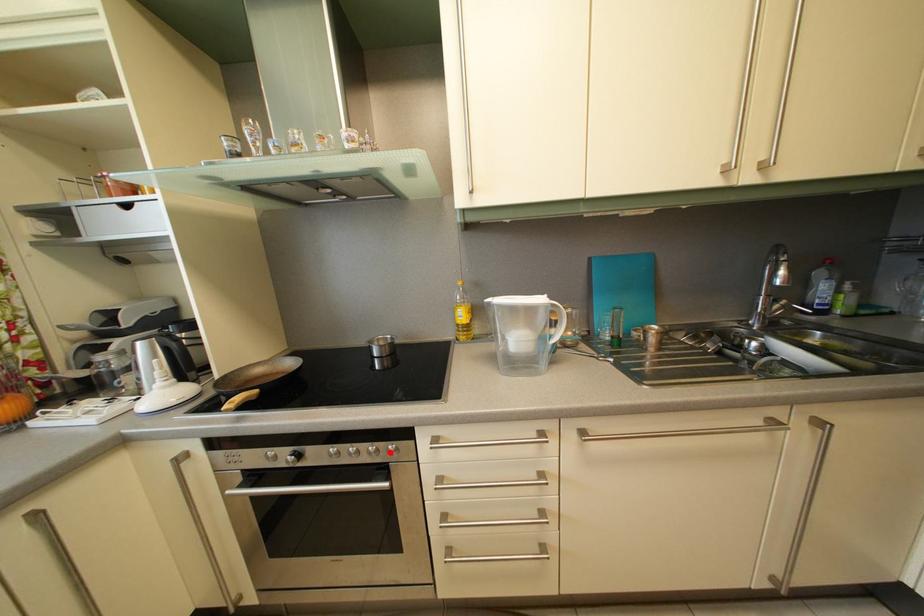
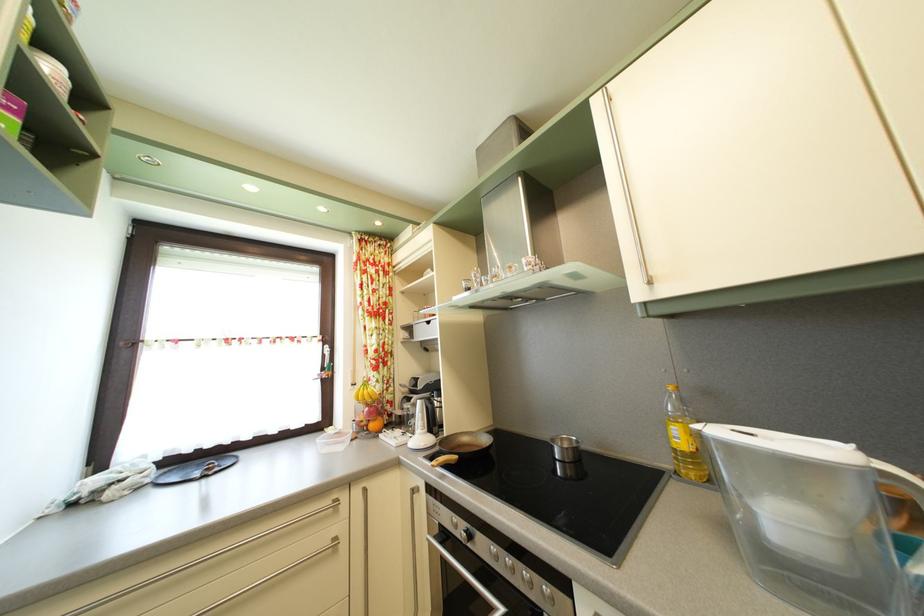
Question: I am providing you with two images of the same scene from different viewpoints. A red point is shown in image1. For the corresponding object point in image2, is it positioned nearer or farther from the camera?

Choices:
 (A) Nearer
 (B) Farther

Answer: (A)